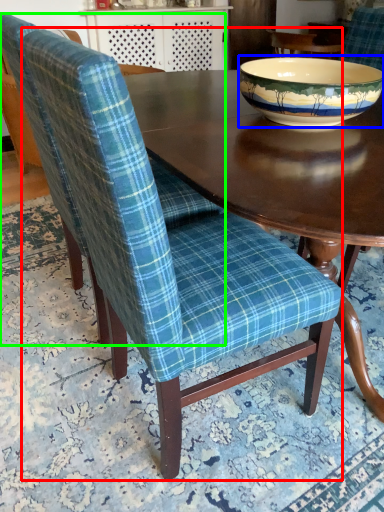
Question: Estimate the real-world distances between objects in this image. Which object is farther from chair (highlighted by a red box), bowl (highlighted by a blue box) or chair (highlighted by a green box)?

Choices:
 (A) bowl
 (B) chair

Answer: (A)